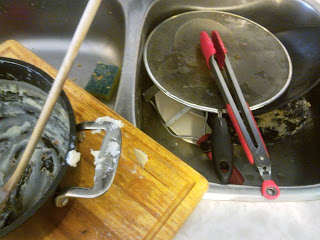
You are a GUI agent. You are given a task and a screenshot of the screen. Output one action in this format:
    pyautogui.click(x=<x>, y=<y>)
    Task: Click on the wooden spoon
    Image resolution: width=320 pixels, height=240 pixels.
    Given the screenshot: What is the action you would take?
    pyautogui.click(x=64, y=68)